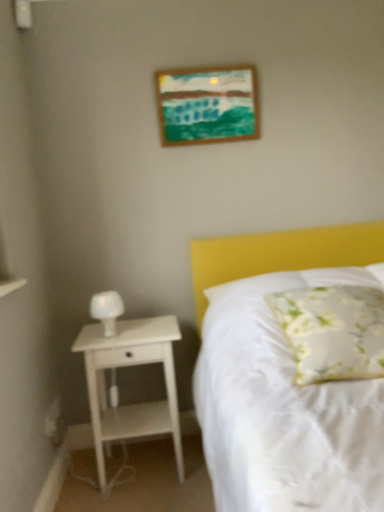
The height and width of the screenshot is (512, 384). What do you see at coordinates (126, 366) in the screenshot? I see `white wood nightstand at left` at bounding box center [126, 366].

The image size is (384, 512). What do you see at coordinates (332, 331) in the screenshot?
I see `floral fabric pillow at center` at bounding box center [332, 331].

The image size is (384, 512). In order to click on white matte bedside lamp at left in this screenshot , I will do `click(107, 310)`.

Which is in front, point (109, 302) or point (175, 122)?

The point (109, 302) is closer to the camera.

Is white matte bedside lamp at left oriented towards wooden picture frame at upper center?

Answer: No, white matte bedside lamp at left is not facing towards wooden picture frame at upper center.

From a real-world perspective, who is located higher, white matte bedside lamp at left or wooden picture frame at upper center?

From a 3D spatial view, wooden picture frame at upper center is above.

Is white matte bedside lamp at left positioned beyond the bounds of wooden picture frame at upper center?

Yes, white matte bedside lamp at left is not within wooden picture frame at upper center.

Is white matte bedside lamp at left oriented towards floral fabric pillow at center?

No, white matte bedside lamp at left is not facing towards floral fabric pillow at center.

Is white matte bedside lamp at left taller or shorter than floral fabric pillow at center?

Clearly, white matte bedside lamp at left is shorter compared to floral fabric pillow at center.

Between point (114, 333) and point (312, 302), which one is positioned in front?

The point (312, 302) is closer to the camera.

Which of these two, white matte bedside lamp at left or floral fabric pillow at center, is bigger?

floral fabric pillow at center.

Is point (355, 295) positioned in front of point (171, 329)?

Yes, it is.

How many degrees apart are the facing directions of floral fabric pillow at center and white wood nightstand at left?

They differ by 4.83 degrees in their facing directions.

Considering the relative sizes of floral fabric pillow at center and white wood nightstand at left in the image provided, is floral fabric pillow at center wider than white wood nightstand at left?

Yes, floral fabric pillow at center is wider than white wood nightstand at left.

Would you say wooden picture frame at upper center is inside or outside floral fabric pillow at center?

wooden picture frame at upper center is spatially situated outside floral fabric pillow at center.

Is wooden picture frame at upper center oriented towards floral fabric pillow at center?

No, wooden picture frame at upper center is not facing towards floral fabric pillow at center.

Is point (243, 130) positioned before point (318, 346)?

No, (243, 130) is further to viewer.

Are wooden picture frame at upper center and floral fabric pillow at center beside each other?

No, wooden picture frame at upper center is not with floral fabric pillow at center.

I want to click on nightstand located in front of the wooden picture frame at upper center, so click(x=126, y=366).

Between white wood nightstand at left and wooden picture frame at upper center, which one has less height?

wooden picture frame at upper center.

Which is less distant, (178, 423) or (249, 94)?

Point (178, 423).

Is white wood nightstand at left to the left of wooden picture frame at upper center from the viewer's perspective?

Correct, you'll find white wood nightstand at left to the left of wooden picture frame at upper center.

Considering the relative positions of white wood nightstand at left and floral fabric pillow at center in the image provided, is white wood nightstand at left to the left or to the right of floral fabric pillow at center?

white wood nightstand at left is positioned on floral fabric pillow at center's left side.

Considering their positions, is white wood nightstand at left located in front of or behind floral fabric pillow at center?

white wood nightstand at left is positioned farther from the viewer than floral fabric pillow at center.

Which is further, [105,430] or [323,379]?

The point [105,430] is behind.

Considering the sizes of objects wooden picture frame at upper center and white matte bedside lamp at left in the image provided, who is taller, wooden picture frame at upper center or white matte bedside lamp at left?

wooden picture frame at upper center is taller.

From the image's perspective, is wooden picture frame at upper center positioned above or below white matte bedside lamp at left?

wooden picture frame at upper center is situated higher than white matte bedside lamp at left in the image.

Is wooden picture frame at upper center further to camera compared to white matte bedside lamp at left?

That is True.

Can you tell me how much wooden picture frame at upper center and white matte bedside lamp at left differ in facing direction?

The angle between the facing direction of wooden picture frame at upper center and the facing direction of white matte bedside lamp at left is 0.491 degrees.

The image size is (384, 512). In the image, there is a white matte bedside lamp at left. What are the coordinates of `picture frame above it (from the image's perspective)` in the screenshot? It's located at (207, 105).

What are the coordinates of `pillow that appears on the right of white matte bedside lamp at left` in the screenshot? It's located at (332, 331).

Consider the image. Considering their positions, is wooden picture frame at upper center positioned further to white wood nightstand at left than floral fabric pillow at center?

Based on the image, wooden picture frame at upper center appears to be further to white wood nightstand at left.

Considering their positions, is white wood nightstand at left positioned closer to white matte bedside lamp at left than floral fabric pillow at center?

The object closer to white matte bedside lamp at left is white wood nightstand at left.

Based on their spatial positions, is wooden picture frame at upper center or white wood nightstand at left further from white matte bedside lamp at left?

Among the two, wooden picture frame at upper center is located further to white matte bedside lamp at left.

When comparing their distances from floral fabric pillow at center, does white matte bedside lamp at left or wooden picture frame at upper center seem closer?

Among the two, white matte bedside lamp at left is located nearer to floral fabric pillow at center.

From the image, which object appears to be farther from wooden picture frame at upper center, floral fabric pillow at center or white matte bedside lamp at left?

floral fabric pillow at center is further to wooden picture frame at upper center.

Based on their spatial positions, is wooden picture frame at upper center or white wood nightstand at left further from floral fabric pillow at center?

wooden picture frame at upper center is positioned further to the anchor floral fabric pillow at center.

Based on their spatial positions, is wooden picture frame at upper center or white matte bedside lamp at left closer to floral fabric pillow at center?

white matte bedside lamp at left is closer to floral fabric pillow at center.

Consider the image. Which object lies further to the anchor point white matte bedside lamp at left, floral fabric pillow at center or white wood nightstand at left?

Among the two, floral fabric pillow at center is located further to white matte bedside lamp at left.

Locate an element on the screen. The image size is (384, 512). nightstand between white matte bedside lamp at left and floral fabric pillow at center is located at coordinates (126, 366).

Find the location of `pillow between wooden picture frame at upper center and white wood nightstand at left vertically`. pillow between wooden picture frame at upper center and white wood nightstand at left vertically is located at coordinates (332, 331).

Locate an element on the screen. bedside lamp that lies between wooden picture frame at upper center and floral fabric pillow at center from top to bottom is located at coordinates (107, 310).

Where is `bedside lamp between wooden picture frame at upper center and white wood nightstand at left from top to bottom`? Image resolution: width=384 pixels, height=512 pixels. bedside lamp between wooden picture frame at upper center and white wood nightstand at left from top to bottom is located at coordinates (107, 310).